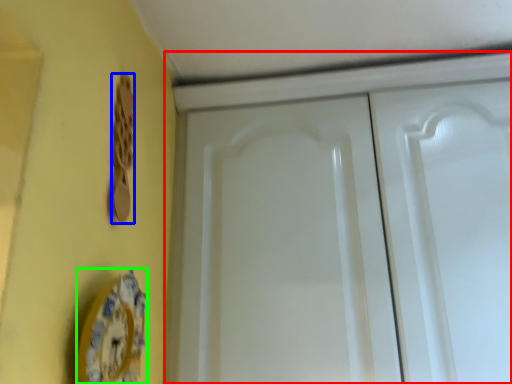
Question: Which object is positioned farthest from cabinetry (highlighted by a red box)? Select from door handle (highlighted by a blue box) and plate (highlighted by a green box).

Choices:
 (A) door handle
 (B) plate

Answer: (B)